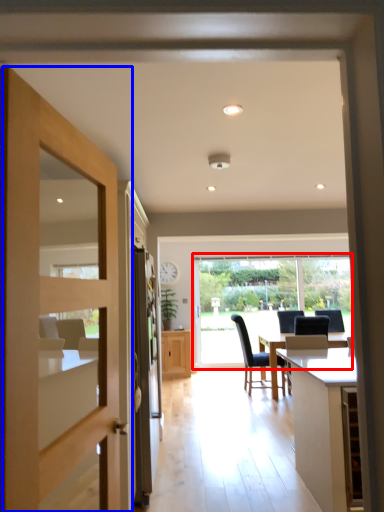
Question: Which point is closer to the camera, window (highlighted by a red box) or door (highlighted by a blue box)?

Choices:
 (A) window
 (B) door

Answer: (B)